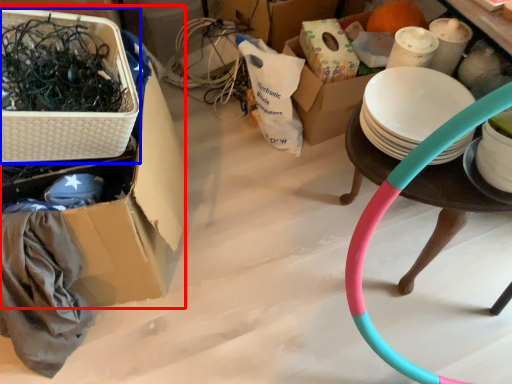
Question: Which object appears closest to the camera in this image, box (highlighted by a red box) or basket (highlighted by a blue box)?

Choices:
 (A) box
 (B) basket

Answer: (B)